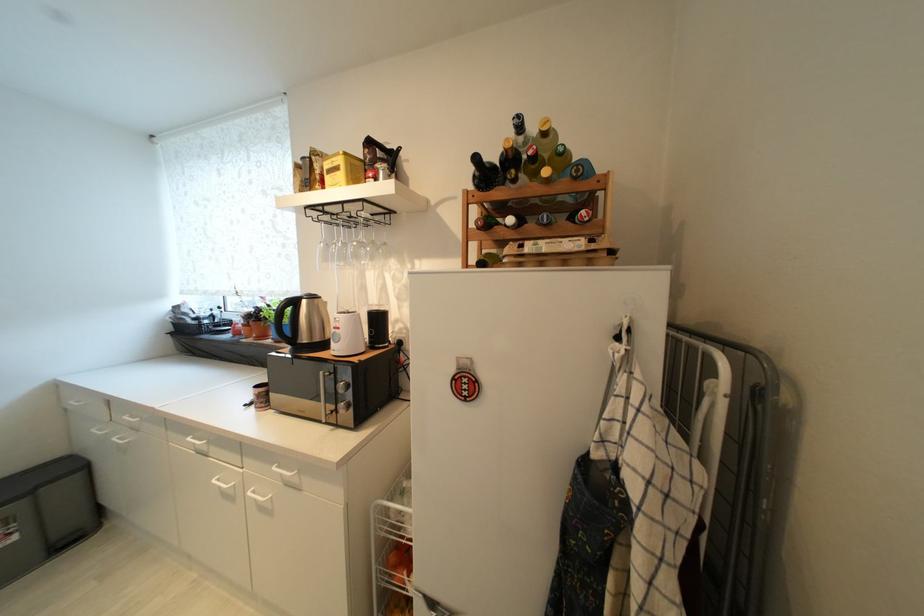
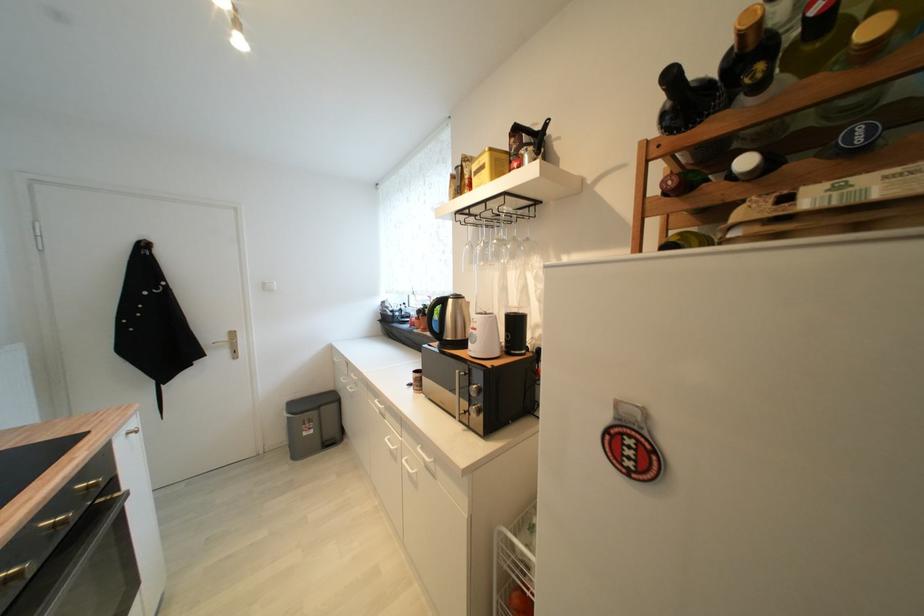
In the second image, find the point that corresponds to [383,321] in the first image.

(521, 325)